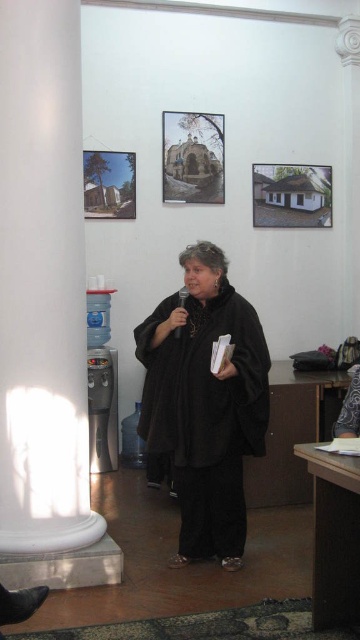
You are standing in the room and want to place a small plant pot exactly at point (69, 308). The plant pot requires a space that is at least 2 meters away from the camera to avoid blocking the speaker. Is this point suitable?

The distance of point (69, 308) from camera is 2.95 meters, so yes, the point is suitable because it is farther than the required 2 meters.

You are standing in the room and see two points marked in the image. The first point is at coordinates point (x=30, y=147) and the second is at point (x=237, y=406). If you want to walk from the first point to the second point, will you need to go around the large white column on the left side of the room?

Point (x=30, y=147) is in front of point (x=237, y=406), so you can walk directly from the first point to the second point without needing to go around the large white column on the left side of the room.